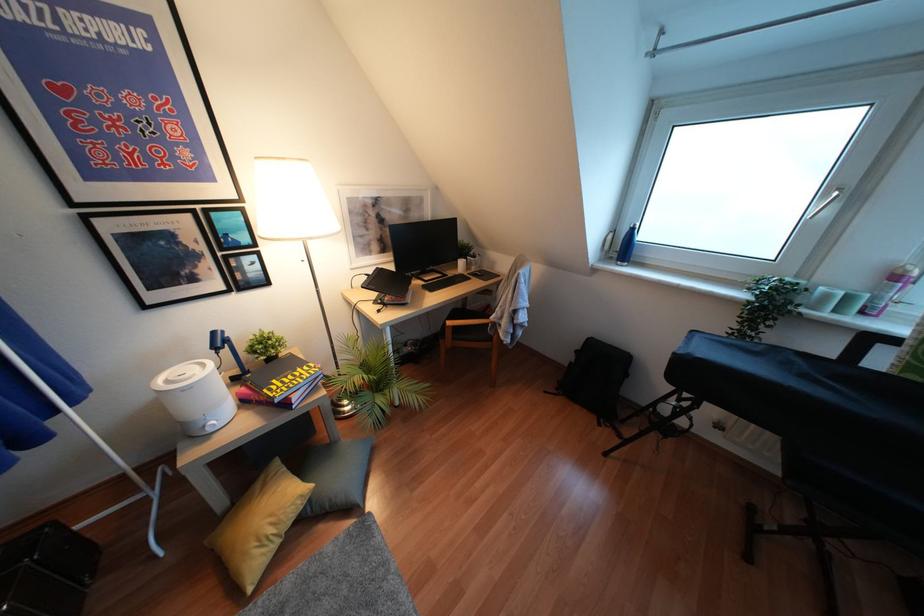
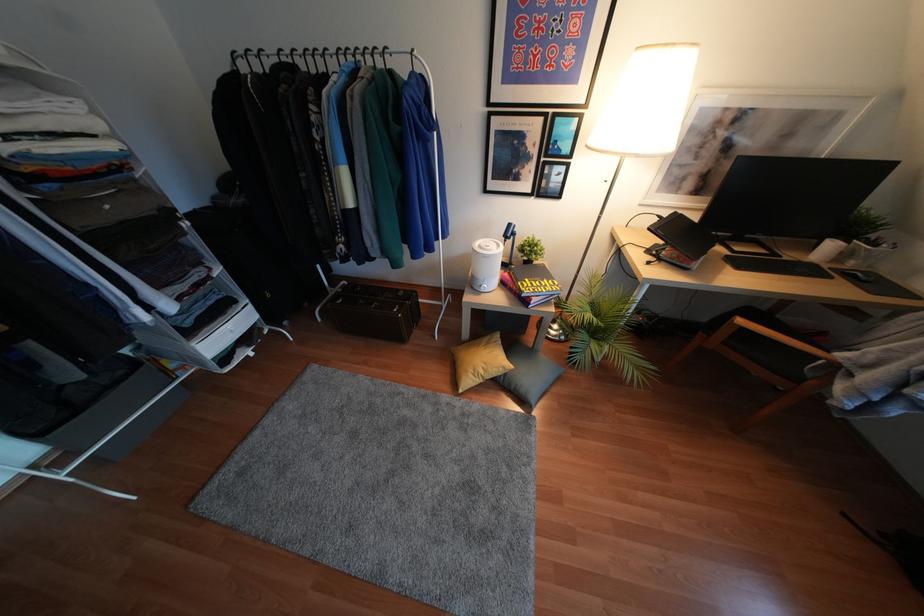
Find the pixel in the second image that matches (210,430) in the first image.

(481, 290)